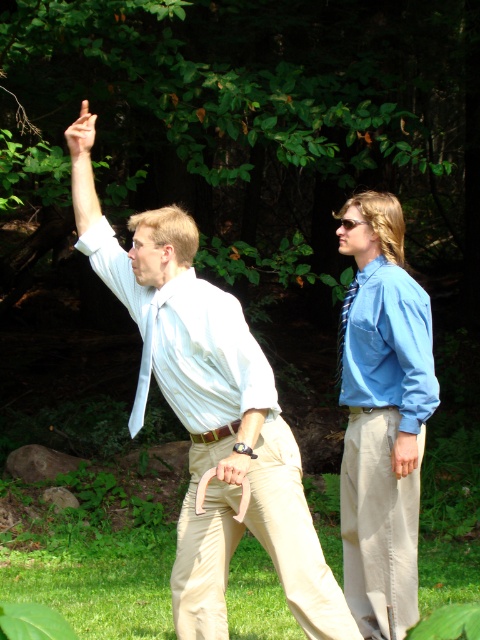
Question: Is green leafy tree at upper center smaller than khaki pants at right?

Choices:
 (A) yes
 (B) no

Answer: (B)

Question: Does green leafy tree at upper center have a larger size compared to shiny blue tie at right?

Choices:
 (A) no
 (B) yes

Answer: (B)

Question: Which of these objects is positioned farthest from the light blue shirt at center?

Choices:
 (A) white silk tie at center
 (B) shiny blue tie at right
 (C) green leafy tree at upper center
 (D) khaki pants at right

Answer: (C)

Question: Which of the following is the farthest from the observer?

Choices:
 (A) (420, 365)
 (B) (338, 339)
 (C) (148, 365)
 (D) (283, 477)

Answer: (B)

Question: Does khaki pants at right appear over white silk tie at center?

Choices:
 (A) yes
 (B) no

Answer: (B)

Question: Which object is positioned closest to the light blue shirt at center?

Choices:
 (A) khaki pants at right
 (B) shiny blue tie at right

Answer: (A)